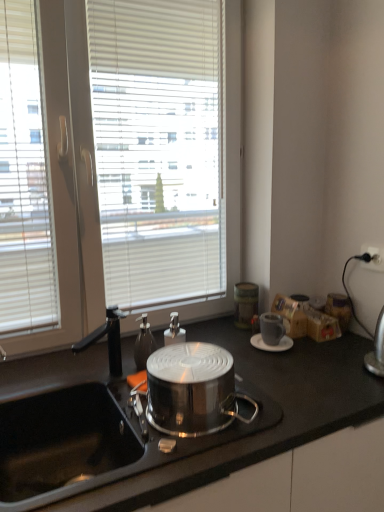
Locate an element on the screen. This screenshot has height=512, width=384. vacant area that lies to the right of white matte saucer at right is located at coordinates (320, 354).